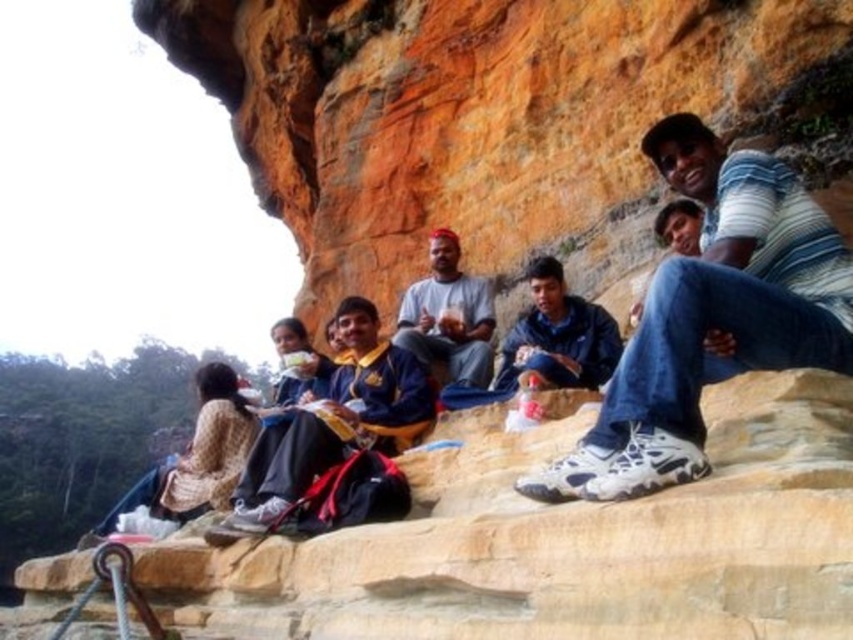
Is orange rock at center positioned behind yellow fabric shirt at center?

Yes, orange rock at center is behind yellow fabric shirt at center.

Who is more distant from viewer, (523, 198) or (282, 460)?

Point (523, 198)

Identify the location of orange rock at center. (498, 120).

Identify the location of orange rock at center. (498, 120).

Does yellowish rock at center have a lesser height compared to matte gray shirt at center?

In fact, yellowish rock at center may be taller than matte gray shirt at center.

Which is more to the right, yellowish rock at center or matte gray shirt at center?

matte gray shirt at center is more to the right.

Image resolution: width=853 pixels, height=640 pixels. Describe the element at coordinates (560, 541) in the screenshot. I see `yellowish rock at center` at that location.

Locate an element on the screen. yellowish rock at center is located at coordinates (560, 541).

Where is `yellow fabric shirt at center`? yellow fabric shirt at center is located at coordinates (334, 422).

Describe the element at coordinates (334, 422) in the screenshot. I see `yellow fabric shirt at center` at that location.

Between point (392, 424) and point (424, 314), which one is positioned behind?

Positioned behind is point (424, 314).

In order to click on yellow fabric shirt at center in this screenshot , I will do `click(334, 422)`.